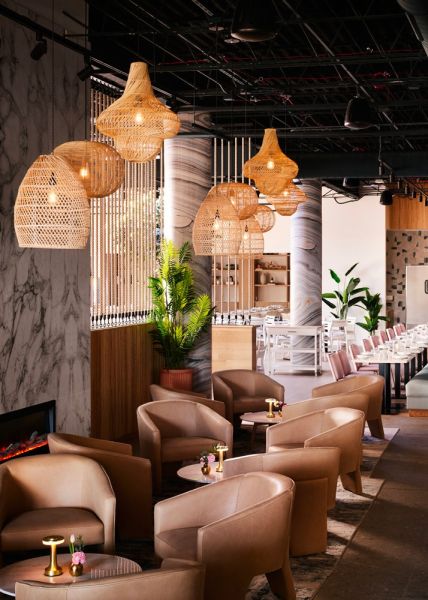
The height and width of the screenshot is (600, 428). Find the location of `fireplace`. fireplace is located at coordinates (29, 426).